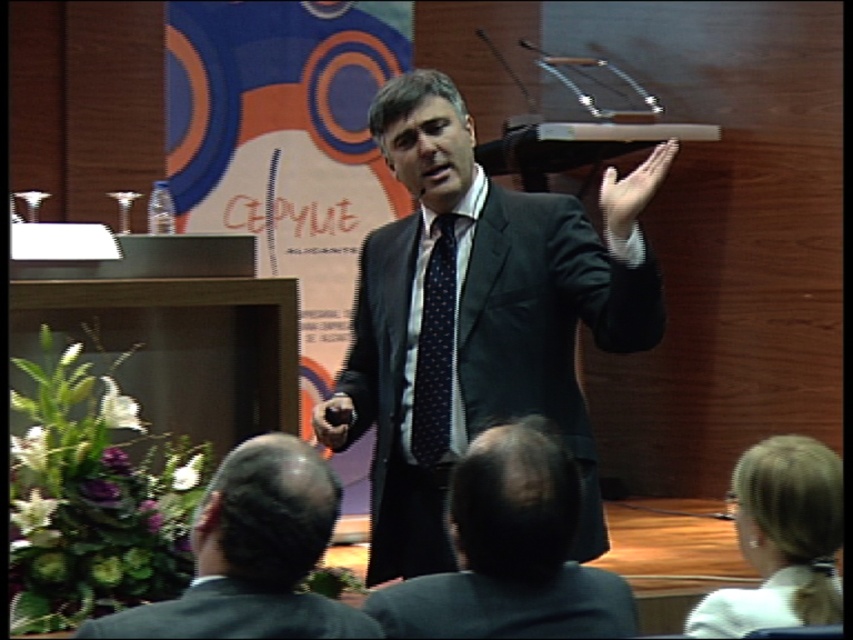
Question: Where is matte black suit at center located in relation to blonde hair at upper right in the image?

Choices:
 (A) below
 (B) above

Answer: (B)

Question: Considering the real-world distances, which object is farthest from the matte black suit at center?

Choices:
 (A) brown leather glove at center
 (B) black suit at center

Answer: (B)

Question: Is black suit at center further to the viewer compared to dark gray suit at lower left?

Choices:
 (A) no
 (B) yes

Answer: (B)

Question: Which object is positioned farthest from the brown leather glove at center?

Choices:
 (A) dark blue dotted fabric tie at center
 (B) matte black suit at center
 (C) matte black hand at upper center
 (D) blonde hair at upper right

Answer: (D)

Question: Which of these objects is positioned closest to the brown leather glove at center?

Choices:
 (A) dark gray suit at lower left
 (B) matte black hand at upper center

Answer: (B)

Question: Observing the image, what is the correct spatial positioning of dark blue dotted fabric tie at center in reference to matte black hand at upper center?

Choices:
 (A) below
 (B) above

Answer: (A)